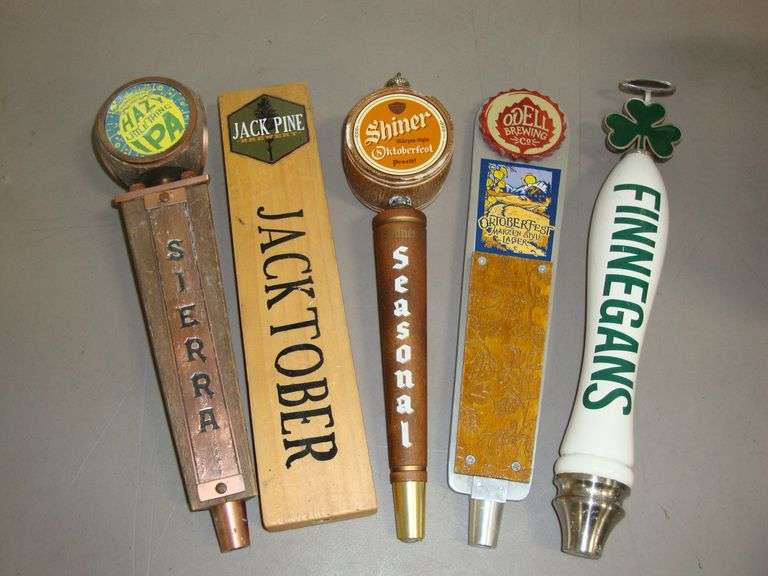
The width and height of the screenshot is (768, 576). Identify the location of beer taps and such. (613, 240), (527, 247), (394, 248), (300, 234), (186, 253).